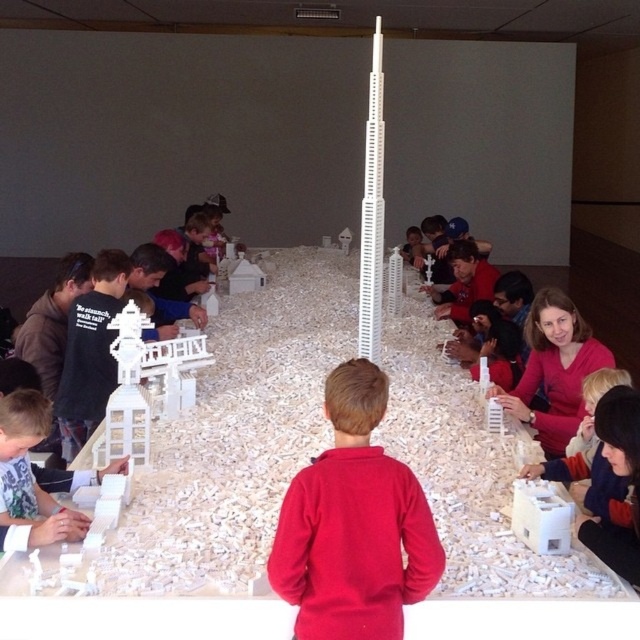
You are a photographer trying to capture a closeup of the architectural models on the table. You notice two points of interest labeled as point (433, 579) and point (536, 355). Which point should you focus on to get a clearer image?

Point (433, 579) is closer to the camera than point (536, 355), so focusing on point (433, 579) will result in a clearer image.

You are a participant in the architectural model activity and need to place a new miniature building exactly at the center of the table. However, there is a red fleece sweater at center currently occupying that spot. Can you determine the exact coordinates of the sweater to ensure you place your building precisely around it?

The red fleece sweater at center is located at point (353, 524), so you should place your miniature building near those coordinates, taking care to avoid overlapping with the sweater.